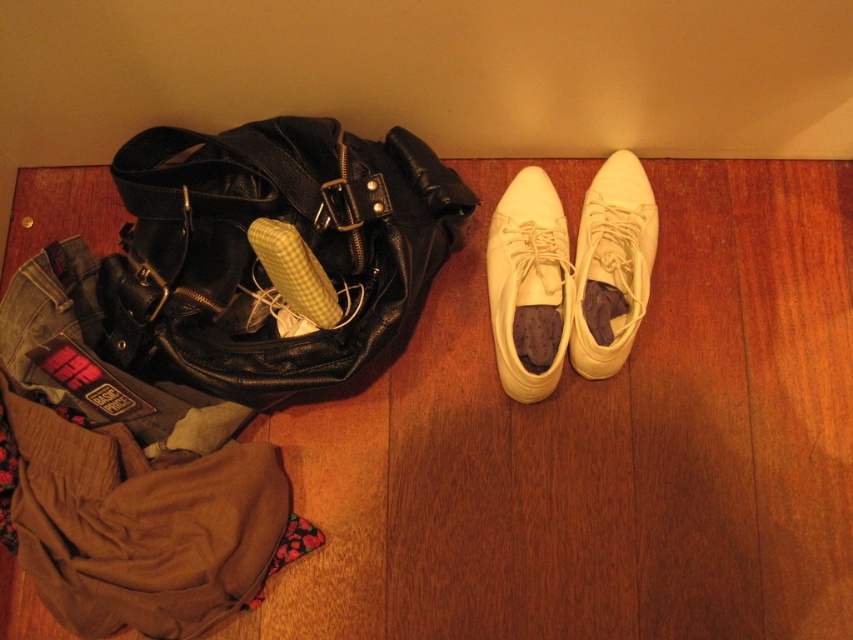
Between white leather shoe at center and white leather running shoe at center right, which one is positioned higher?

white leather running shoe at center right

Between white leather shoe at center and white leather running shoe at center right, which one is positioned lower?

white leather shoe at center is lower down.

Which is in front, point (509, 332) or point (608, 172)?

Positioned in front is point (509, 332).

Image resolution: width=853 pixels, height=640 pixels. Identify the location of white leather shoe at center. (529, 285).

Based on the photo, who is lower down, black leather bag at left or white leather shoe at center?

white leather shoe at center is below.

Find the location of a particular element. This screenshot has height=640, width=853. black leather bag at left is located at coordinates (254, 256).

Who is higher up, black leather bag at left or white leather running shoe at center right?

black leather bag at left is above.

Consider the image. Between black leather bag at left and white leather running shoe at center right, which one has less height?

With less height is white leather running shoe at center right.

In order to click on black leather bag at left in this screenshot , I will do tap(254, 256).